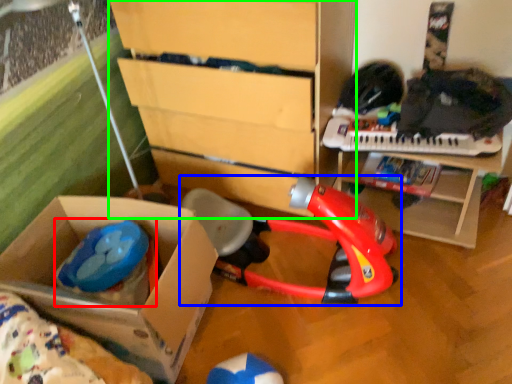
Question: Considering the real-world distances, which object is closest to toy (highlighted by a red box)? toy (highlighted by a blue box) or chest of drawers (highlighted by a green box).

Choices:
 (A) toy
 (B) chest of drawers

Answer: (A)